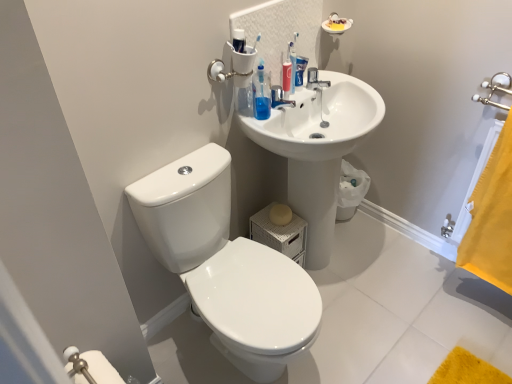
Where is `free space in front of white glossy sink at upper right`? free space in front of white glossy sink at upper right is located at coordinates (367, 328).